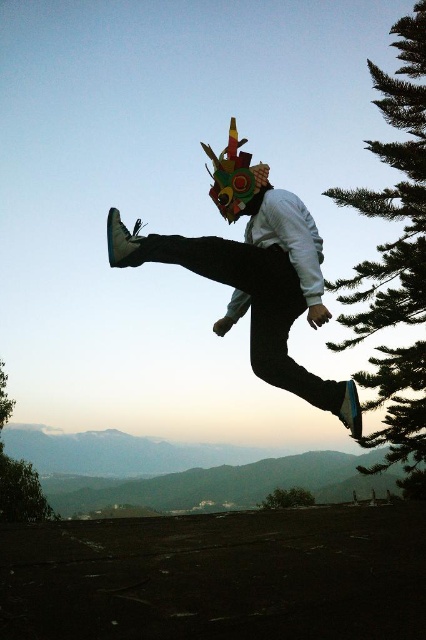
Question: Does green leafy tree at lower left appear on the left side of green matte tree at lower center?

Choices:
 (A) yes
 (B) no

Answer: (A)

Question: Which of the following is the closest to the observer?

Choices:
 (A) green leafy tree at lower left
 (B) green textured pine tree at right
 (C) green matte tree at lower center

Answer: (B)

Question: Where is green leafy tree at lower left located in relation to green matte tree at lower center in the image?

Choices:
 (A) above
 (B) below

Answer: (A)

Question: Which is farther from the green matte tree at lower center?

Choices:
 (A) green textured pine tree at right
 (B) green leafy tree at lower left

Answer: (B)

Question: Which object appears closest to the camera in this image?

Choices:
 (A) green leafy tree at lower left
 (B) green matte tree at lower center

Answer: (A)

Question: In this image, where is green textured pine tree at right located relative to green leafy tree at lower left?

Choices:
 (A) above
 (B) below

Answer: (A)